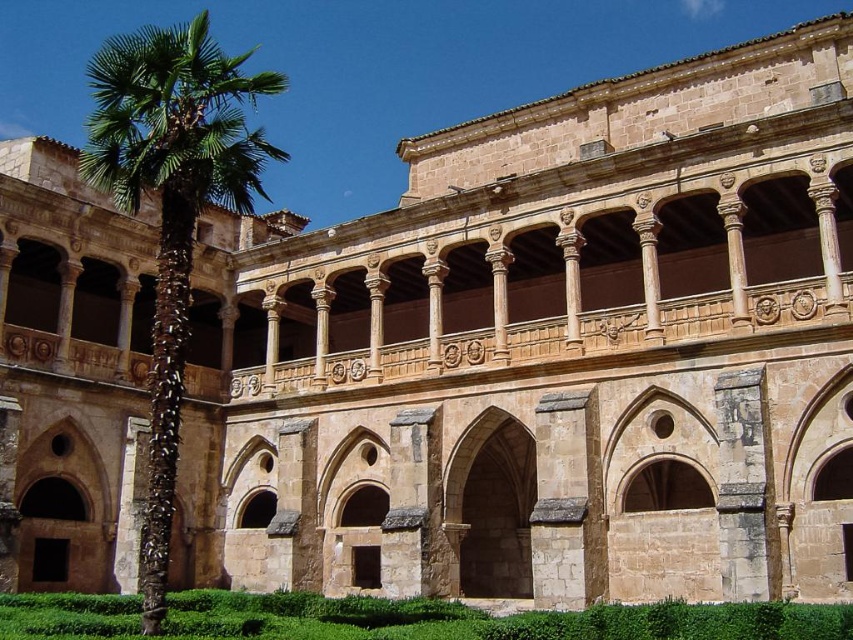
Question: Among these objects, which one is nearest to the camera?

Choices:
 (A) green leafy palm at left
 (B) green leafy hedge at lower center

Answer: (B)

Question: In this image, where is green leafy palm at left located relative to green leafy hedge at lower center?

Choices:
 (A) below
 (B) above

Answer: (B)

Question: In this image, where is green leafy palm at left located relative to green leafy hedge at lower center?

Choices:
 (A) right
 (B) left

Answer: (B)

Question: Which point is farther from the camera taking this photo?

Choices:
 (A) (236, 102)
 (B) (761, 630)

Answer: (A)

Question: Is green leafy palm at left behind green leafy hedge at lower center?

Choices:
 (A) yes
 (B) no

Answer: (A)